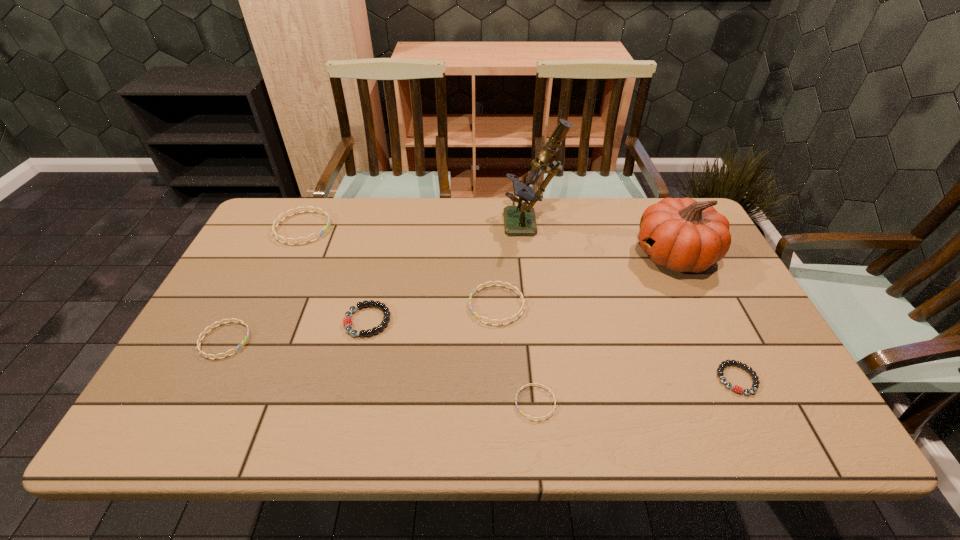
In the image, there is a desktop. Find the location of `free space at the left edge`. free space at the left edge is located at coordinates (230, 307).

Where is `free spot between the smaller black bracelet and the tallest object`? This screenshot has width=960, height=540. free spot between the smaller black bracelet and the tallest object is located at coordinates (635, 302).

Where is `free point between the biggest blue bracelet and the left black bracelet`? This screenshot has width=960, height=540. free point between the biggest blue bracelet and the left black bracelet is located at coordinates (335, 274).

This screenshot has height=540, width=960. What are the coordinates of `vacant area between the bigger black bracelet and the nearest blue bracelet` in the screenshot? It's located at (451, 362).

Locate an element on the screen. The image size is (960, 540). vacant space in between the second smallest blue bracelet and the second tallest object is located at coordinates coord(449,298).

Image resolution: width=960 pixels, height=540 pixels. I want to click on free space between the second biggest blue bracelet and the rightmost bracelet, so click(617, 342).

Locate an element on the screen. free space between the third smallest blue bracelet and the shortest object is located at coordinates (516, 354).

Where is `empty space that is in between the farthest bracelet and the farther black bracelet`? The image size is (960, 540). empty space that is in between the farthest bracelet and the farther black bracelet is located at coordinates pos(335,274).

Locate an element on the screen. The height and width of the screenshot is (540, 960). blank region between the third biggest blue bracelet and the third smallest blue bracelet is located at coordinates (361, 322).

At what (x,y) coordinates should I click in order to perform the action: click on empty space between the tallest bracelet and the third biggest blue bracelet. Please return your answer as a coordinate pair (x, y). The image size is (960, 540). Looking at the image, I should click on (264, 284).